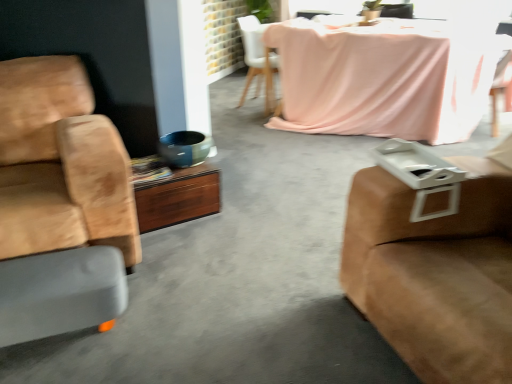
Locate an element on the screen. vacant space to the right of wooden desk at center is located at coordinates (240, 221).